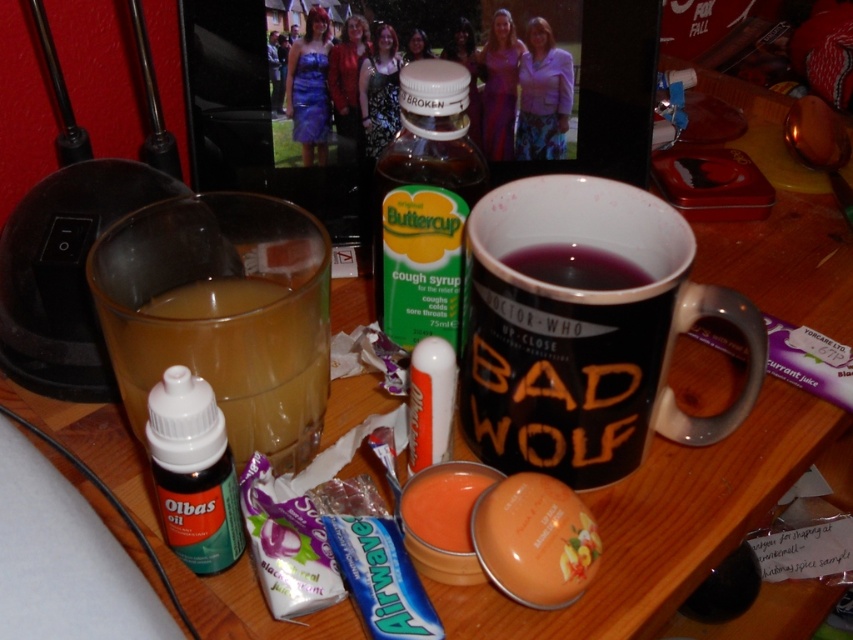
Is matte orange lip balm at center further to camera compared to smooth orange lip balm at center?

No, it is in front of smooth orange lip balm at center.

Where is `matte orange lip balm at center`? The width and height of the screenshot is (853, 640). matte orange lip balm at center is located at coordinates (534, 540).

The width and height of the screenshot is (853, 640). In order to click on matte orange lip balm at center in this screenshot , I will do `click(534, 540)`.

Between black matte mug at center and matte orange lip balm at center, which one is positioned lower?

matte orange lip balm at center

Does black matte mug at center have a smaller size compared to matte orange lip balm at center?

Incorrect, black matte mug at center is not smaller in size than matte orange lip balm at center.

Is point (653, 378) closer to camera compared to point (556, 538)?

No.

The width and height of the screenshot is (853, 640). Identify the location of black matte mug at center. (584, 328).

This screenshot has height=640, width=853. Identify the location of green plastic bottle at center. (424, 204).